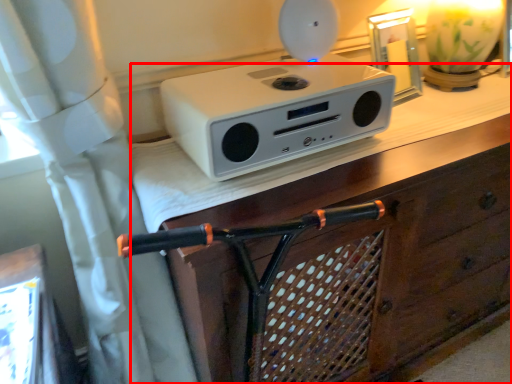
Question: In this image, where is vanity (annotated by the red box) located relative to home appliance?

Choices:
 (A) left
 (B) right

Answer: (B)